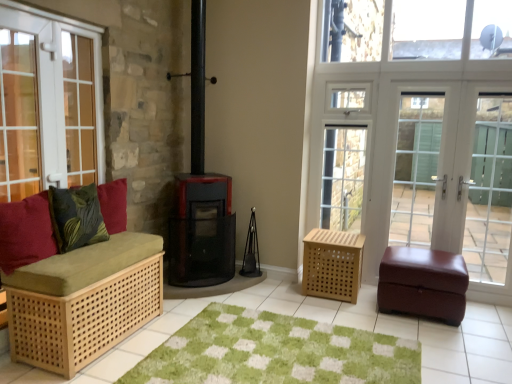
Question: Is velvet red cushion at left, the second pillow in the back-to-front sequence, to the right of matte white screen door at right, the 2th screen door in the right-to-left sequence, from the viewer's perspective?

Choices:
 (A) no
 (B) yes

Answer: (A)

Question: Is velvet red cushion at left, which ranks as the 1th pillow in front-to-back order, turned away from matte white screen door at right, the second screen door in the left-to-right sequence?

Choices:
 (A) yes
 (B) no

Answer: (B)

Question: Considering the relative positions of velvet red cushion at left, which ranks as the 1th pillow in front-to-back order, and matte white screen door at right, the second screen door in the left-to-right sequence, in the image provided, is velvet red cushion at left, which ranks as the 1th pillow in front-to-back order, to the left of matte white screen door at right, the second screen door in the left-to-right sequence, from the viewer's perspective?

Choices:
 (A) no
 (B) yes

Answer: (B)

Question: Is velvet red cushion at left, the second pillow in the back-to-front sequence, facing towards matte white screen door at right, the second screen door in the left-to-right sequence?

Choices:
 (A) no
 (B) yes

Answer: (A)

Question: Is velvet red cushion at left, which ranks as the 1th pillow in front-to-back order, positioned in front of matte white screen door at right, the second screen door in the left-to-right sequence?

Choices:
 (A) no
 (B) yes

Answer: (B)

Question: Can we say velvet red cushion at left, which ranks as the 1th pillow in front-to-back order, lies outside matte white screen door at right, the second screen door in the left-to-right sequence?

Choices:
 (A) no
 (B) yes

Answer: (B)

Question: Is white glass screen door at right, placed as the third screen door when sorted from right to left, positioned with its back to burgundy leather ottoman at right, which is the 3th furniture in left-to-right order?

Choices:
 (A) yes
 (B) no

Answer: (B)

Question: Is white glass screen door at right, placed as the third screen door when sorted from right to left, not near burgundy leather ottoman at right, arranged as the 1th furniture when viewed from the right?

Choices:
 (A) yes
 (B) no

Answer: (B)

Question: Is burgundy leather ottoman at right, which is the 3th furniture in left-to-right order, surrounded by white glass screen door at right, placed as the first screen door when sorted from left to right?

Choices:
 (A) no
 (B) yes

Answer: (A)

Question: Can you confirm if white glass screen door at right, placed as the first screen door when sorted from left to right, is bigger than burgundy leather ottoman at right, arranged as the 1th furniture when viewed from the right?

Choices:
 (A) yes
 (B) no

Answer: (B)

Question: Can you confirm if white glass screen door at right, placed as the first screen door when sorted from left to right, is thinner than burgundy leather ottoman at right, which is the 3th furniture in left-to-right order?

Choices:
 (A) no
 (B) yes

Answer: (B)

Question: Is white glass screen door at right, placed as the first screen door when sorted from left to right, at the right side of burgundy leather ottoman at right, arranged as the 1th furniture when viewed from the right?

Choices:
 (A) yes
 (B) no

Answer: (A)

Question: Is light brown woven basket at center-right, which ranks as the 2th furniture in left-to-right order, far away from velvety green pillow at left, the first pillow when ordered from back to front?

Choices:
 (A) no
 (B) yes

Answer: (B)